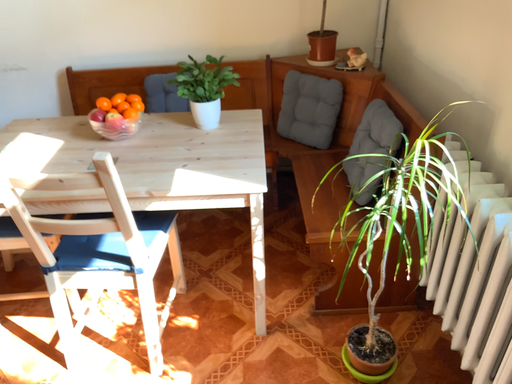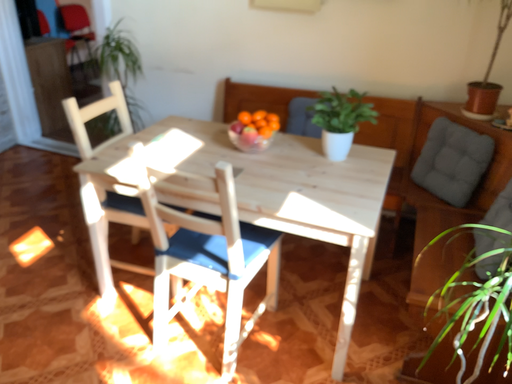
Question: Which way did the camera rotate in the video?

Choices:
 (A) rotated left
 (B) rotated right

Answer: (A)